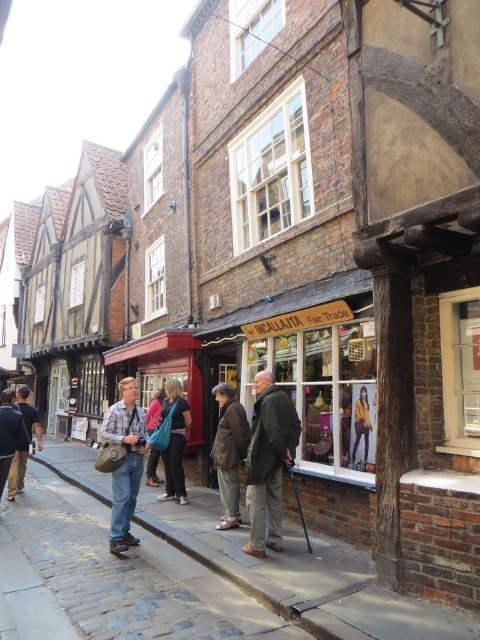
You are standing on the cobblestone pavement at lower left and want to take a photo of the dark brown leather jacket at center. Which direction should you move to get a better view of the jacket?

Since the cobblestone pavement at lower left is closer to the viewer than the dark brown leather jacket at center, you should move forward towards the jacket to get a better view.

You are standing at the center of the street in the historic European town. You want to take a photo of the cobblestone pavement at lower left. In which direction should you move to get closer to it?

You should move towards the lower left direction to get closer to the cobblestone pavement at lower left, as it is located at point (302,576) in the image.